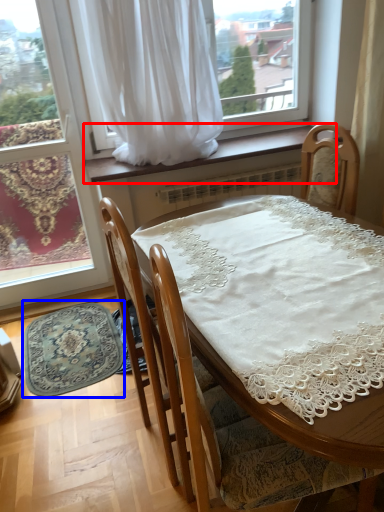
Question: Which point is closer to the camera, window sill (highlighted by a red box) or mat (highlighted by a blue box)?

Choices:
 (A) window sill
 (B) mat

Answer: (B)